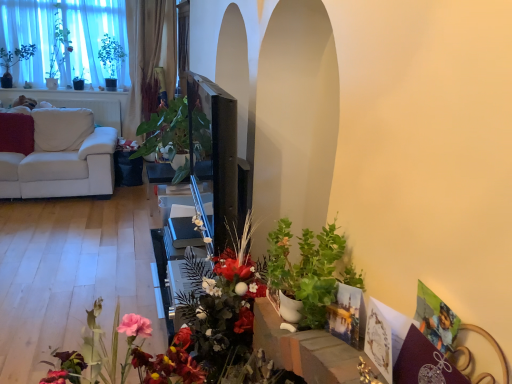
Question: Does green matte plant at lower right, which appears as the 1th houseplant when viewed from the right, have a lesser height compared to white fabric couch at left?

Choices:
 (A) yes
 (B) no

Answer: (A)

Question: Does green matte plant at lower right, marked as the second houseplant in a left-to-right arrangement, have a smaller size compared to white fabric couch at left?

Choices:
 (A) yes
 (B) no

Answer: (A)

Question: Is green matte plant at lower right, arranged as the second houseplant when viewed from the back, thinner than white fabric couch at left?

Choices:
 (A) yes
 (B) no

Answer: (A)

Question: Considering the relative sizes of green matte plant at lower right, marked as the second houseplant in a left-to-right arrangement, and white fabric couch at left in the image provided, is green matte plant at lower right, marked as the second houseplant in a left-to-right arrangement, taller than white fabric couch at left?

Choices:
 (A) yes
 (B) no

Answer: (B)

Question: Is green matte plant at lower right, arranged as the second houseplant when viewed from the back, turned away from white fabric couch at left?

Choices:
 (A) no
 (B) yes

Answer: (A)

Question: From the image's perspective, is green matte plant at upper left located above or below green matte plant at lower right, positioned as the second houseplant in top-to-bottom order?

Choices:
 (A) below
 (B) above

Answer: (B)

Question: Is green matte plant at upper left to the left or to the right of green matte plant at lower right, which appears as the 1th houseplant when viewed from the right, in the image?

Choices:
 (A) left
 (B) right

Answer: (A)

Question: In terms of width, does green matte plant at upper left look wider or thinner when compared to green matte plant at lower right, positioned as the second houseplant in top-to-bottom order?

Choices:
 (A) thin
 (B) wide

Answer: (A)

Question: Is green matte plant at upper left bigger or smaller than green matte plant at lower right, arranged as the second houseplant when viewed from the back?

Choices:
 (A) big
 (B) small

Answer: (A)

Question: Based on their positions, is green glossy plant at center, which is the first houseplant in left-to-right order, located to the left or right of white fabric couch at left?

Choices:
 (A) right
 (B) left

Answer: (A)

Question: From the image's perspective, is green glossy plant at center, the first houseplant viewed from the back, above or below white fabric couch at left?

Choices:
 (A) below
 (B) above

Answer: (B)

Question: Considering the positions of point (139, 129) and point (81, 185), is point (139, 129) closer or farther from the camera than point (81, 185)?

Choices:
 (A) farther
 (B) closer

Answer: (A)

Question: Which is correct: green glossy plant at center, positioned as the second houseplant in right-to-left order, is inside white fabric couch at left, or outside of it?

Choices:
 (A) outside
 (B) inside

Answer: (A)

Question: Is matte floral arrangement at center taller or shorter than green matte plant at upper left?

Choices:
 (A) short
 (B) tall

Answer: (A)

Question: Would you say matte floral arrangement at center is to the left or to the right of green matte plant at upper left in the picture?

Choices:
 (A) right
 (B) left

Answer: (A)